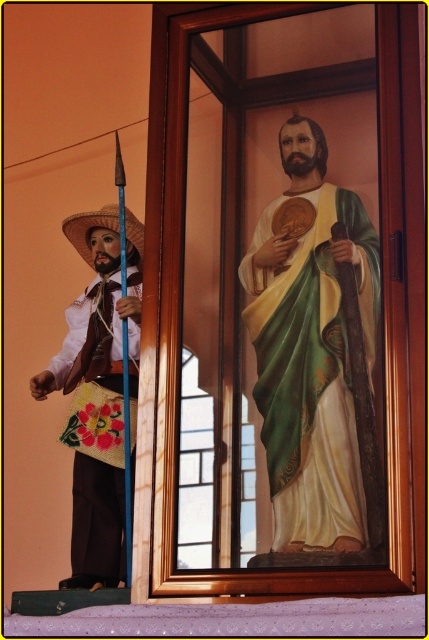
Is matte green robe at center bigger than embroidered fabric purse at left?

Indeed, matte green robe at center has a larger size compared to embroidered fabric purse at left.

Is point (316, 236) positioned in front of point (84, 508)?

That is True.

Where is `matte green robe at center`? matte green robe at center is located at coordinates (310, 348).

Who is more distant from viewer, (365, 252) or (72, 218)?

The point (72, 218) is more distant.

Is point (332, 458) less distant than point (69, 220)?

That is True.

Identify the location of matte green robe at center. (310, 348).

Can you confirm if embroidered fabric purse at left is positioned above strawmaterial/texturecowboy hat at left?

Incorrect, embroidered fabric purse at left is not positioned above strawmaterial/texturecowboy hat at left.

Does embroidered fabric purse at left appear under strawmaterial/texturecowboy hat at left?

Indeed, embroidered fabric purse at left is positioned under strawmaterial/texturecowboy hat at left.

What are the coordinates of `embroidered fabric purse at left` in the screenshot? It's located at coord(94,429).